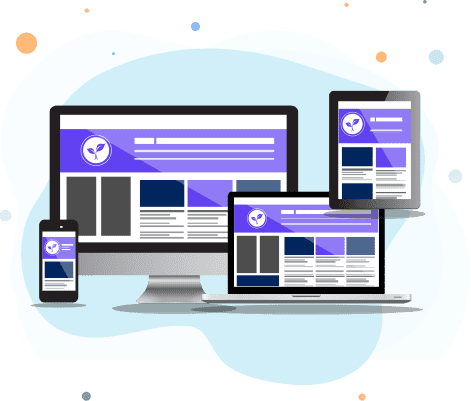
Image resolution: width=471 pixels, height=401 pixels. I want to click on monitor stand, so click(172, 288).